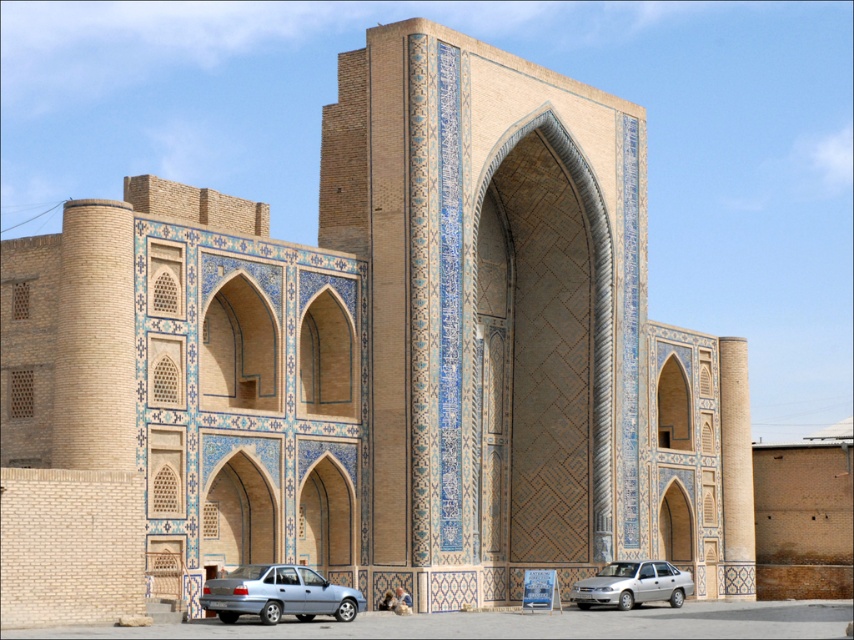
Question: Which point appears farthest from the camera in this image?

Choices:
 (A) tap(273, 588)
 (B) tap(656, 582)

Answer: (B)

Question: Which point is farther to the camera?

Choices:
 (A) (589, 582)
 (B) (259, 605)

Answer: (A)

Question: Can you confirm if silver metallic sedan at lower center is wider than silver metallic car at lower center?

Choices:
 (A) yes
 (B) no

Answer: (B)

Question: Observing the image, what is the correct spatial positioning of silver metallic sedan at lower center in reference to silver metallic car at lower center?

Choices:
 (A) right
 (B) left

Answer: (B)

Question: Is silver metallic sedan at lower center below silver metallic car at lower center?

Choices:
 (A) yes
 (B) no

Answer: (B)